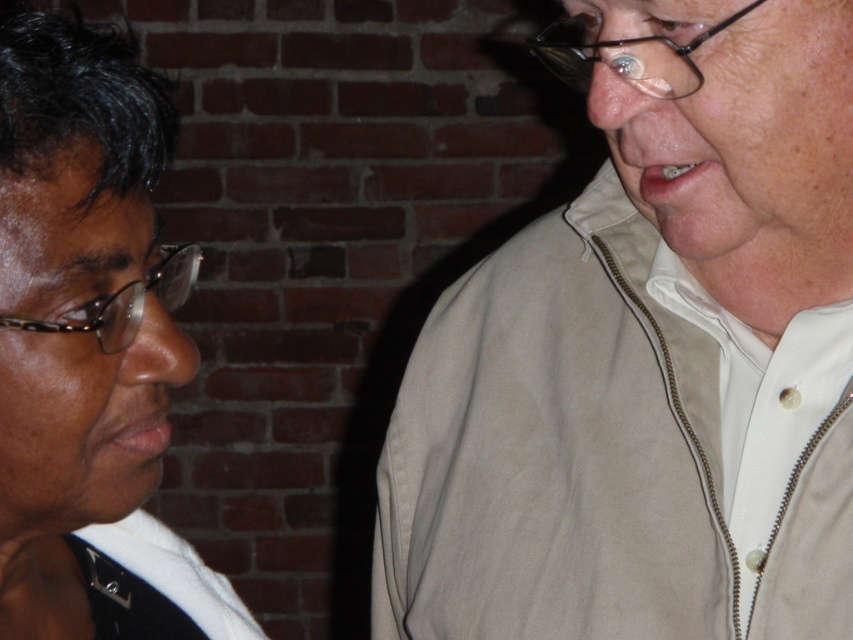
Question: Which object appears farthest from the camera in this image?

Choices:
 (A) black glossy hair at upper left
 (B) beige zip-up jacket at right

Answer: (B)

Question: Among these objects, which one is nearest to the camera?

Choices:
 (A) beige zip-up jacket at right
 (B) black glossy hair at upper left

Answer: (B)

Question: Is beige zip-up jacket at right positioned behind black glossy hair at upper left?

Choices:
 (A) yes
 (B) no

Answer: (A)

Question: Is beige zip-up jacket at right to the left of black glossy hair at upper left from the viewer's perspective?

Choices:
 (A) no
 (B) yes

Answer: (A)

Question: Can you confirm if beige zip-up jacket at right is smaller than black glossy hair at upper left?

Choices:
 (A) yes
 (B) no

Answer: (B)